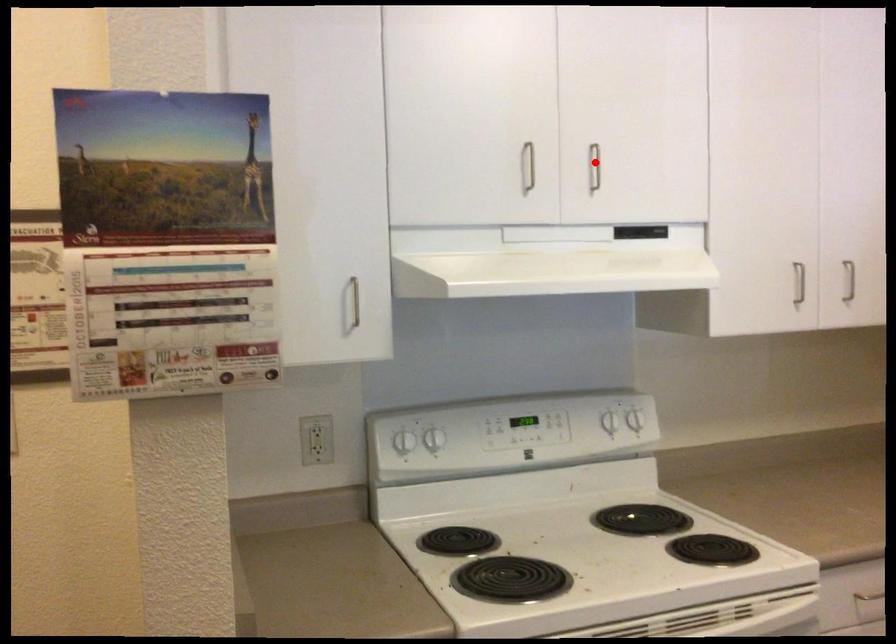
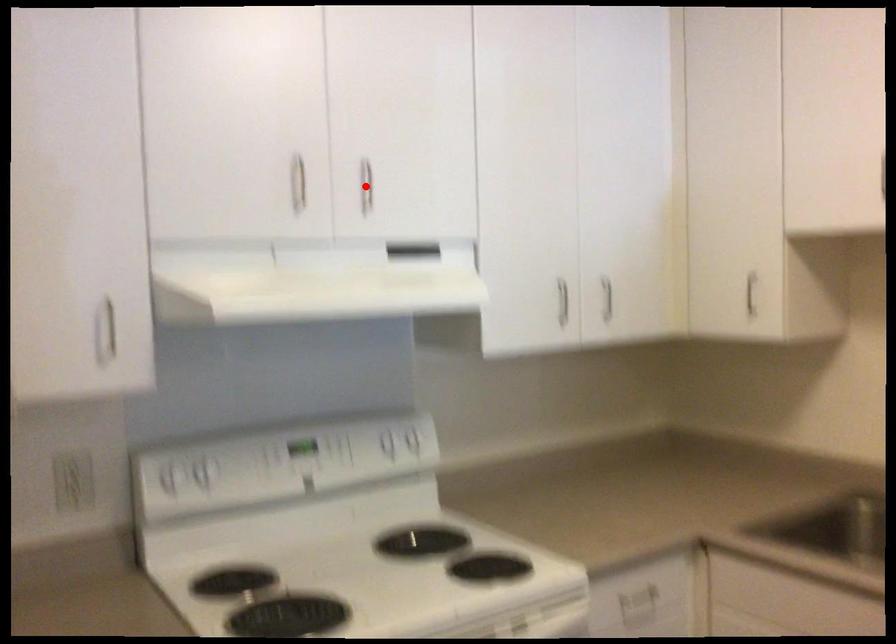
I am providing you with two images of the same scene from different viewpoints. A red point is marked on the first image and another point is marked on the second image. Does the point marked in image1 correspond to the same location as the one in image2?

Yes